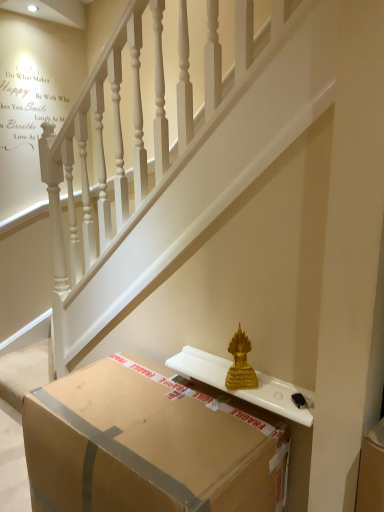
Describe the element at coordinates (142, 126) in the screenshot. I see `gold statue at center` at that location.

Locate an element on the screen. This screenshot has width=384, height=512. gold statue at center is located at coordinates (142, 126).

The height and width of the screenshot is (512, 384). I want to click on brown cardboard box at lower center, so click(147, 446).

Measure the distance between brown cardboard box at lower center and camera.

1.08 meters.

What do you see at coordinates (147, 446) in the screenshot?
I see `brown cardboard box at lower center` at bounding box center [147, 446].

In order to click on gold statue at center in this screenshot , I will do `click(142, 126)`.

Would you say gold statue at center is to the left or to the right of brown cardboard box at lower center in the picture?

gold statue at center is positioned on brown cardboard box at lower center's right side.

Is gold statue at center positioned in front of brown cardboard box at lower center?

No.

Which is less distant, (129, 39) or (257, 432)?

Point (129, 39) is positioned farther from the camera compared to point (257, 432).

From the image's perspective, which object appears higher, gold statue at center or brown cardboard box at lower center?

gold statue at center is shown above in the image.

From a real-world perspective, is gold statue at center located higher than brown cardboard box at lower center?

Yes, from a real-world perspective, gold statue at center is over brown cardboard box at lower center

Considering the relative sizes of gold statue at center and brown cardboard box at lower center in the image provided, is gold statue at center wider than brown cardboard box at lower center?

No.

Can you confirm if gold statue at center is taller than brown cardboard box at lower center?

Yes, gold statue at center is taller than brown cardboard box at lower center.

Considering the sizes of objects gold statue at center and brown cardboard box at lower center in the image provided, who is smaller, gold statue at center or brown cardboard box at lower center?

gold statue at center.

Which is correct: gold statue at center is inside brown cardboard box at lower center, or outside of it?

gold statue at center is outside brown cardboard box at lower center.

Are gold statue at center and brown cardboard box at lower center making contact?

There is a gap between gold statue at center and brown cardboard box at lower center.

Could you tell me if gold statue at center is turned towards brown cardboard box at lower center?

Yes, gold statue at center is turned towards brown cardboard box at lower center.

What's the angular difference between gold statue at center and brown cardboard box at lower center's facing directions?

There is a 1.38-degree angle between the facing directions of gold statue at center and brown cardboard box at lower center.

Locate an element on the screen. The height and width of the screenshot is (512, 384). stairs above the brown cardboard box at lower center (from a real-world perspective) is located at coordinates (142, 126).

Can you confirm if brown cardboard box at lower center is positioned to the right of gold statue at center?

Incorrect, brown cardboard box at lower center is not on the right side of gold statue at center.

Which object is further away from the camera, brown cardboard box at lower center or gold statue at center?

gold statue at center is more distant.

Considering the positions of point (230, 436) and point (135, 78), is point (230, 436) closer or farther from the camera than point (135, 78)?

Point (230, 436).

From the image's perspective, is brown cardboard box at lower center located above gold statue at center?

No.

From a real-world perspective, does brown cardboard box at lower center stand above gold statue at center?

No, from a real-world perspective, brown cardboard box at lower center is not on top of gold statue at center.

Considering the relative sizes of brown cardboard box at lower center and gold statue at center in the image provided, is brown cardboard box at lower center wider than gold statue at center?

Yes.

Considering the sizes of brown cardboard box at lower center and gold statue at center in the image, is brown cardboard box at lower center taller or shorter than gold statue at center?

Clearly, brown cardboard box at lower center is shorter compared to gold statue at center.

Is brown cardboard box at lower center bigger than gold statue at center?

Yes, brown cardboard box at lower center is bigger than gold statue at center.

Is brown cardboard box at lower center located outside gold statue at center?

Yes, brown cardboard box at lower center is not within gold statue at center.

Are brown cardboard box at lower center and gold statue at center far apart?

No, brown cardboard box at lower center is not far away from gold statue at center.

Is brown cardboard box at lower center facing towards gold statue at center?

No.

Can you tell me how much brown cardboard box at lower center and gold statue at center differ in facing direction?

The angle between the facing direction of brown cardboard box at lower center and the facing direction of gold statue at center is 1.38 degrees.

In order to click on stairs on the right of brown cardboard box at lower center in this screenshot , I will do pos(142,126).

The height and width of the screenshot is (512, 384). Identify the location of box below the gold statue at center (from the image's perspective). (147, 446).

This screenshot has width=384, height=512. In order to click on stairs above the brown cardboard box at lower center (from the image's perspective) in this screenshot , I will do `click(142, 126)`.